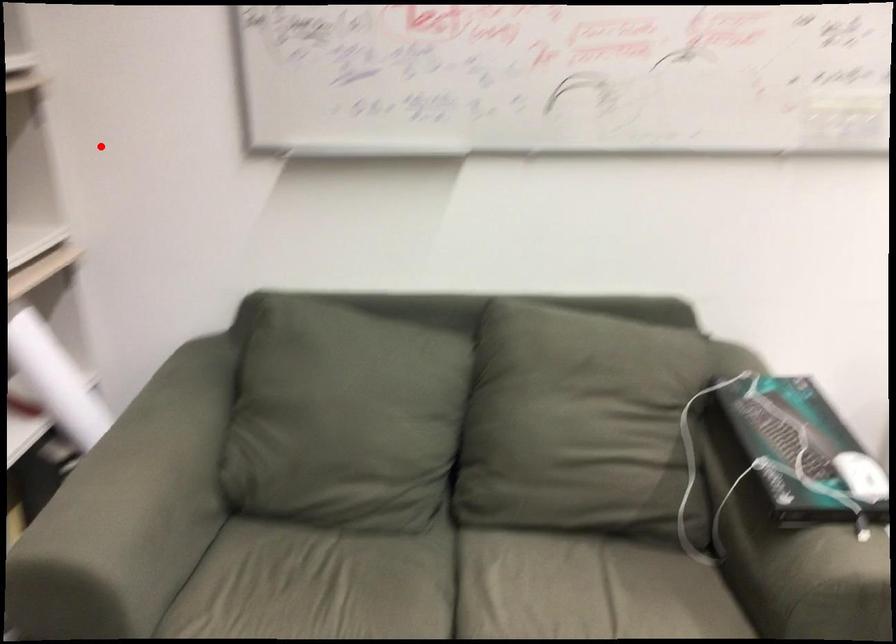
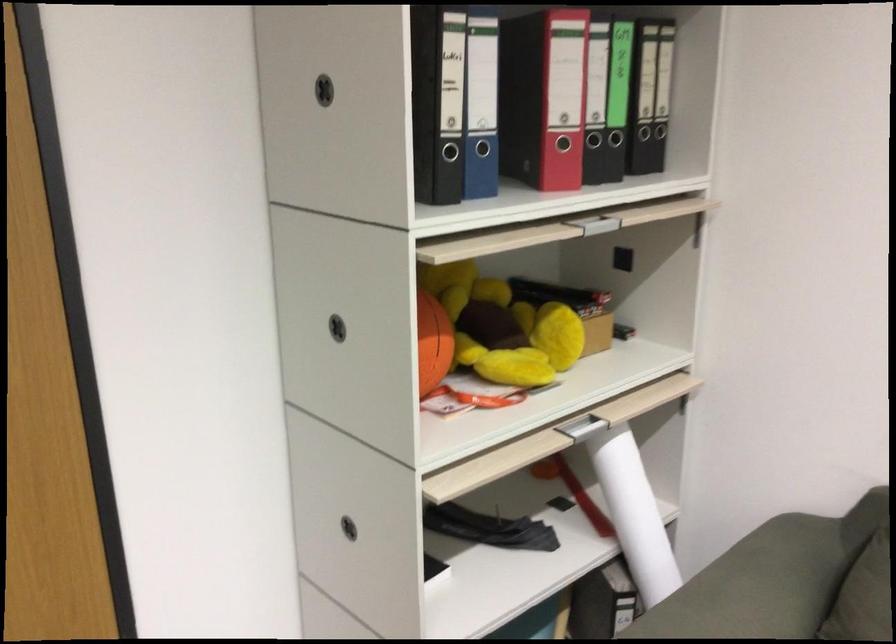
Where in the second image is the point corresponding to the highlighted location from the first image?

(743, 260)